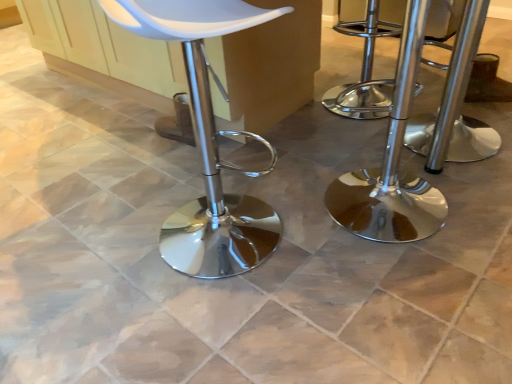
Locate an element on the screen. free space in front of white matte stool at center is located at coordinates click(213, 325).